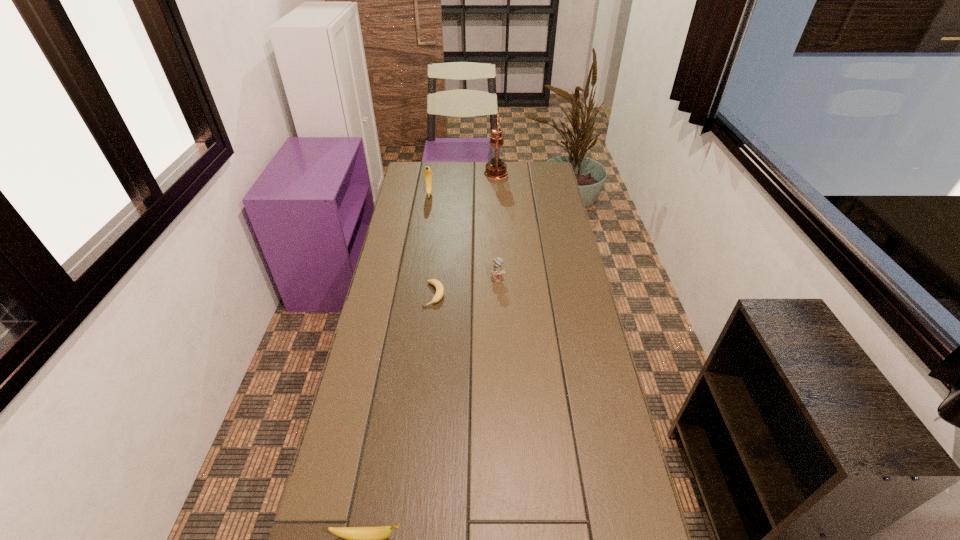
Identify the location of oil lamp. (496, 168).

This screenshot has height=540, width=960. I want to click on the tallest object, so click(x=496, y=168).

Identify the location of the farthest banana. (427, 172).

Locate an element on the screen. The width and height of the screenshot is (960, 540). the fourth nearest object is located at coordinates (427, 172).

Locate an element on the screen. Image resolution: width=960 pixels, height=540 pixels. teddy bear is located at coordinates (497, 271).

Identify the location of the shortest banana. (437, 284).

Find the location of a particular element. The height and width of the screenshot is (540, 960). the shortest object is located at coordinates (437, 284).

Find the location of a particular element. vacant space located 0.190m on the front of the farthest object is located at coordinates (497, 202).

Locate an element on the screen. vacant space located from the stem of the fourth nearest object is located at coordinates [420, 251].

Locate an element on the screen. Image resolution: width=960 pixels, height=540 pixels. vacant space situated on the front-facing side of the teddy bear is located at coordinates (500, 328).